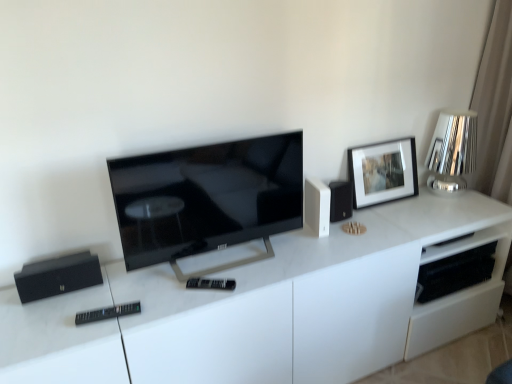
This screenshot has height=384, width=512. What are the coordinates of `free location to the right of white matte speaker at upper right` in the screenshot? It's located at (356, 236).